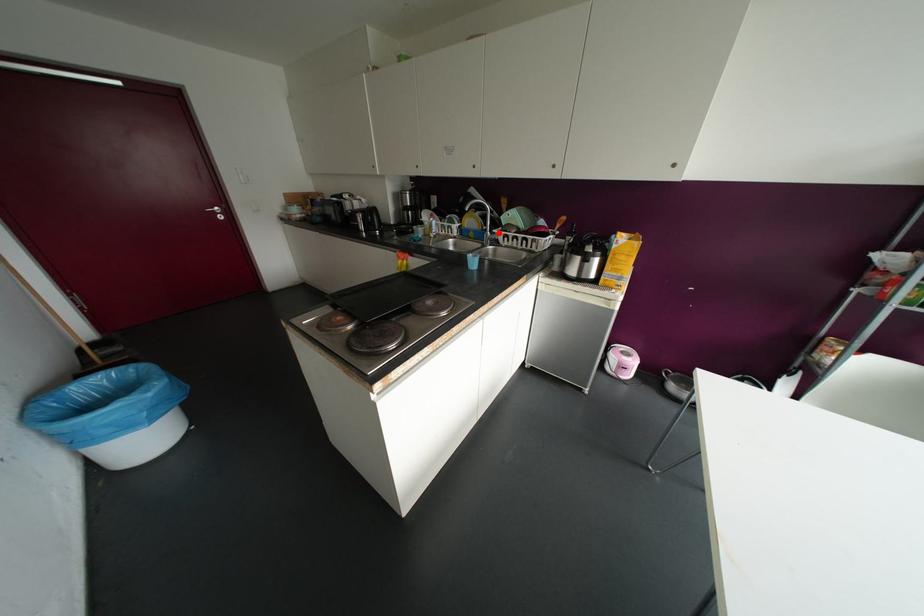
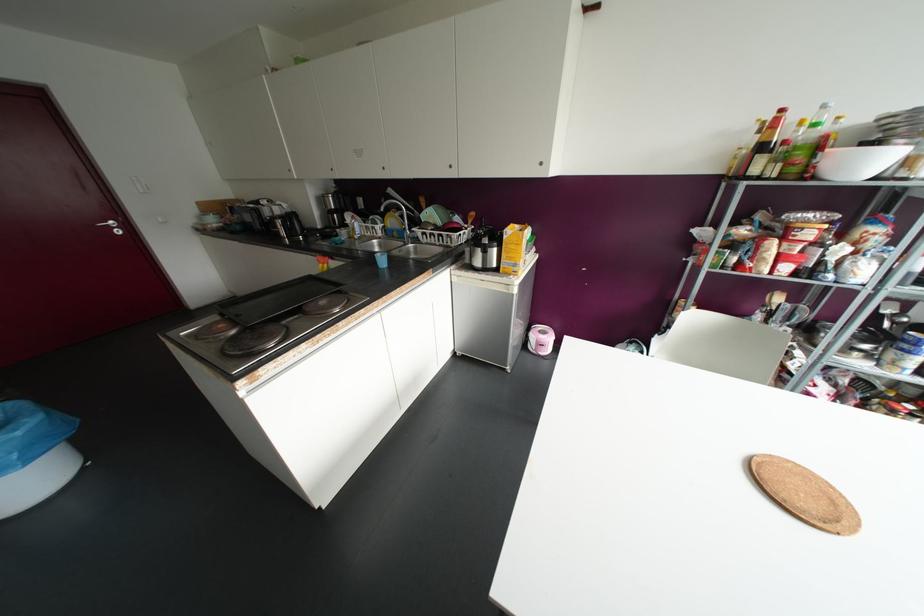
Find the pixel in the second image that matches the highlighted location in the first image.

(417, 231)